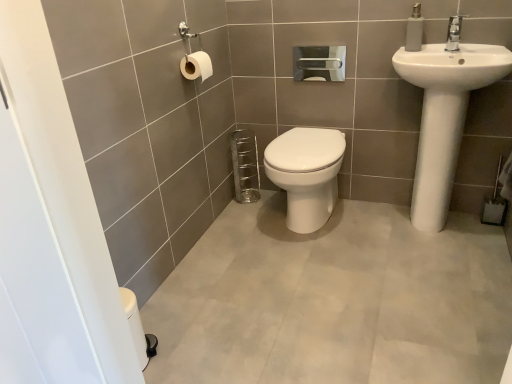
At what (x,y) coordinates should I click in order to perform the action: click on space that is in front of white ceramic faucet at upper right. Please return your answer as a coordinate pair (x, y). This screenshot has width=512, height=384. Looking at the image, I should click on (459, 52).